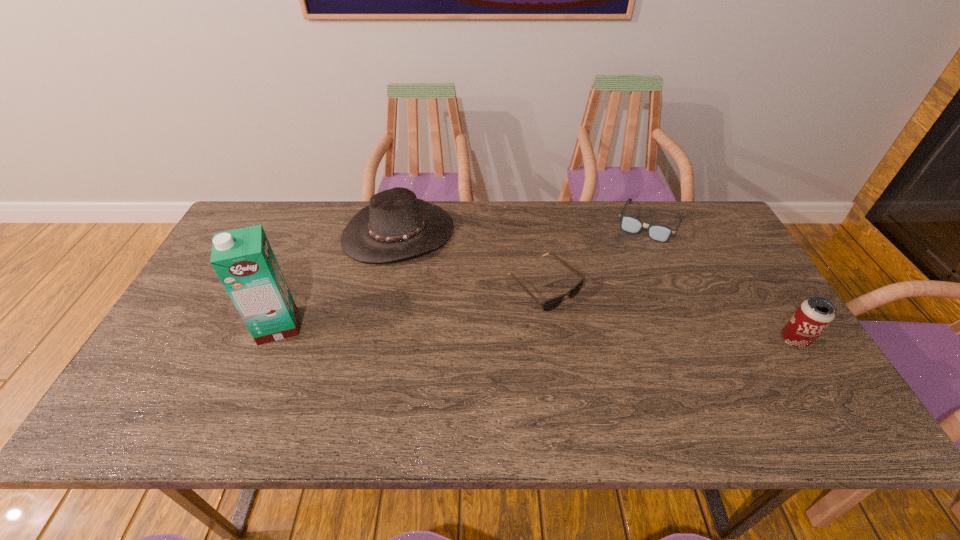
Identify which object is located as the second nearest to the rightmost object. Please provide its 2D coordinates. Your answer should be formatted as a tuple, i.e. [(x, y)], where the tuple contains the x and y coordinates of a point satisfying the conditions above.

[(552, 303)]

At what (x,y) coordinates should I click in order to perform the action: click on object that is the fourth closest to the hat. Please return your answer as a coordinate pair (x, y). The image size is (960, 540). Looking at the image, I should click on click(x=813, y=316).

At what (x,y) coordinates should I click in order to perform the action: click on blank space that satisfies the following two spatial constraints: 1. on the back side of the sunglasses; 2. on the left side of the carton. Please return your answer as a coordinate pair (x, y). Looking at the image, I should click on (295, 286).